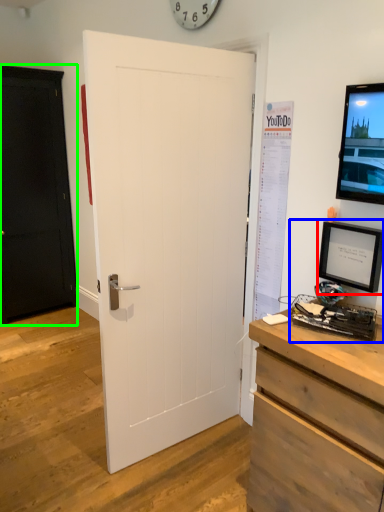
Question: Which object is positioned farthest from picture frame (highlighted by a red box)? Select from desktop computer (highlighted by a blue box) and door (highlighted by a green box).

Choices:
 (A) desktop computer
 (B) door

Answer: (B)